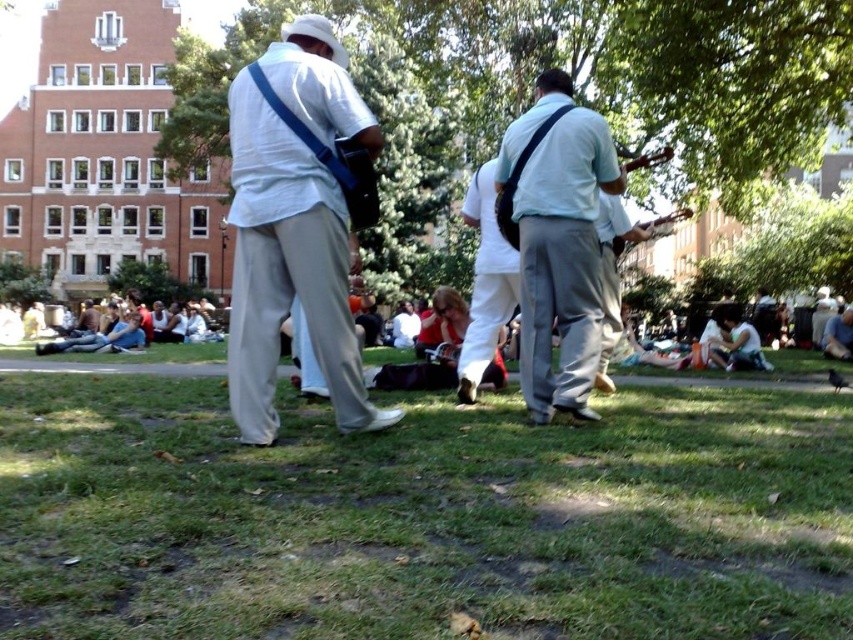
Measure the distance between point (335, 461) and camera.

Point (335, 461) and camera are 186.31 feet apart from each other.

Is point (248, 490) closer to camera compared to point (461, 163)?

Yes, point (248, 490) is in front of point (461, 163).

You are a GUI agent. You are given a task and a screenshot of the screen. Output one action in this format:
    pyautogui.click(x=<x>, y=<y>)
    Task: Click on the green grass at lower center
    The height and width of the screenshot is (640, 853).
    Given the screenshot: What is the action you would take?
    pyautogui.click(x=421, y=516)

Is white matte shirt at center below white cotton shirt at center?

Actually, white matte shirt at center is above white cotton shirt at center.

Does white matte shirt at center come in front of white cotton shirt at center?

That is True.

Between point (242, 150) and point (509, 260), which one is positioned behind?

Positioned behind is point (509, 260).

Image resolution: width=853 pixels, height=640 pixels. I want to click on white matte shirt at center, so click(x=294, y=227).

Does green leafy tree at center come behind light blue fabric guitar at center?

Yes, green leafy tree at center is further from the viewer.

How much distance is there between green leafy tree at center and light blue fabric guitar at center?

green leafy tree at center is 35.14 meters away from light blue fabric guitar at center.

Does point (178, 131) come behind point (579, 116)?

Yes, point (178, 131) is behind point (579, 116).

Locate an element on the screen. green leafy tree at center is located at coordinates (370, 109).